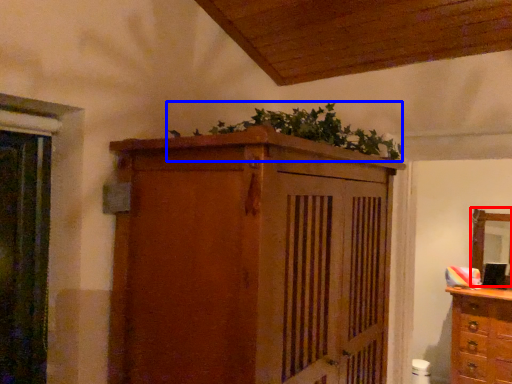
Question: Which point is closer to the camera, mirror (highlighted by a red box) or plant (highlighted by a blue box)?

Choices:
 (A) mirror
 (B) plant

Answer: (B)